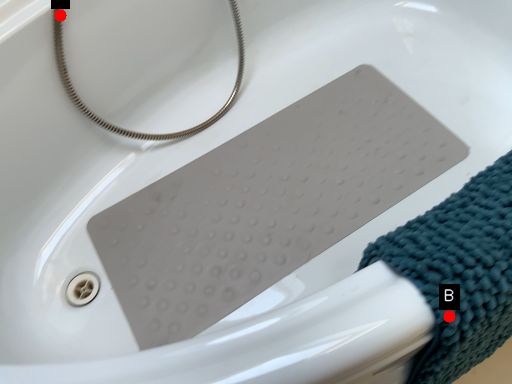
Question: Two points are circled on the image, labeled by A and B beside each circle. Among these points, which one is nearest to the camera?

Choices:
 (A) A is closer
 (B) B is closer

Answer: (B)